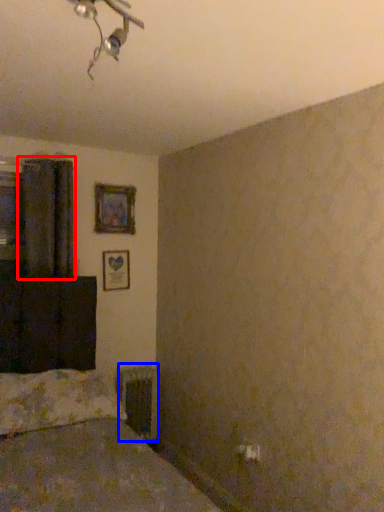
Question: Among these objects, which one is nearest to the camera, curtain (highlighted by a red box) or radiator (highlighted by a blue box)?

Choices:
 (A) curtain
 (B) radiator

Answer: (A)